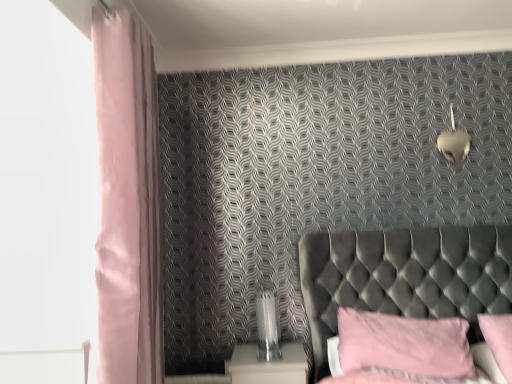
Question: Is the surface of pink fabric pillow at lower right, marked as the 1th pillow in a right-to-left arrangement, in direct contact with pink fabric pillow at lower right, the second pillow viewed from the right?

Choices:
 (A) yes
 (B) no

Answer: (B)

Question: From the image's perspective, would you say pink fabric pillow at lower right, marked as the 1th pillow in a right-to-left arrangement, is positioned over pink fabric pillow at lower right, acting as the 1th pillow starting from the left?

Choices:
 (A) yes
 (B) no

Answer: (A)

Question: Considering the relative positions of pink fabric pillow at lower right, placed as the second pillow when sorted from left to right, and pink fabric pillow at lower right, the second pillow viewed from the right, in the image provided, is pink fabric pillow at lower right, placed as the second pillow when sorted from left to right, in front of pink fabric pillow at lower right, the second pillow viewed from the right,?

Choices:
 (A) no
 (B) yes

Answer: (B)

Question: Is pink fabric pillow at lower right, placed as the second pillow when sorted from left to right, oriented towards pink fabric pillow at lower right, the second pillow viewed from the right?

Choices:
 (A) no
 (B) yes

Answer: (A)

Question: Can you confirm if pink fabric pillow at lower right, placed as the second pillow when sorted from left to right, is positioned to the left of pink fabric pillow at lower right, the second pillow viewed from the right?

Choices:
 (A) no
 (B) yes

Answer: (A)

Question: From the image's perspective, relative to matte pink curtain at left, is white glossy nightstand at lower center above or below?

Choices:
 (A) below
 (B) above

Answer: (A)

Question: Visually, is white glossy nightstand at lower center positioned to the left or to the right of matte pink curtain at left?

Choices:
 (A) right
 (B) left

Answer: (A)

Question: Is point (300, 362) positioned closer to the camera than point (124, 112)?

Choices:
 (A) farther
 (B) closer

Answer: (A)

Question: Is white glossy nightstand at lower center wider or thinner than matte pink curtain at left?

Choices:
 (A) thin
 (B) wide

Answer: (B)

Question: Would you say white glossy nightstand at lower center is inside or outside pink fabric pillow at lower right, the second pillow viewed from the right?

Choices:
 (A) inside
 (B) outside

Answer: (B)

Question: Is point (230, 369) closer or farther from the camera than point (453, 354)?

Choices:
 (A) closer
 (B) farther

Answer: (B)

Question: Is white glossy nightstand at lower center taller or shorter than pink fabric pillow at lower right, the second pillow viewed from the right?

Choices:
 (A) tall
 (B) short

Answer: (B)

Question: Looking at the image, does white glossy nightstand at lower center seem bigger or smaller compared to pink fabric pillow at lower right, the second pillow viewed from the right?

Choices:
 (A) big
 (B) small

Answer: (B)

Question: Considering the positions of metallic heart-shaped light fixture at upper right and white glossy nightstand at lower center in the image, is metallic heart-shaped light fixture at upper right bigger or smaller than white glossy nightstand at lower center?

Choices:
 (A) big
 (B) small

Answer: (B)

Question: Considering the positions of metallic heart-shaped light fixture at upper right and white glossy nightstand at lower center in the image, is metallic heart-shaped light fixture at upper right wider or thinner than white glossy nightstand at lower center?

Choices:
 (A) thin
 (B) wide

Answer: (A)